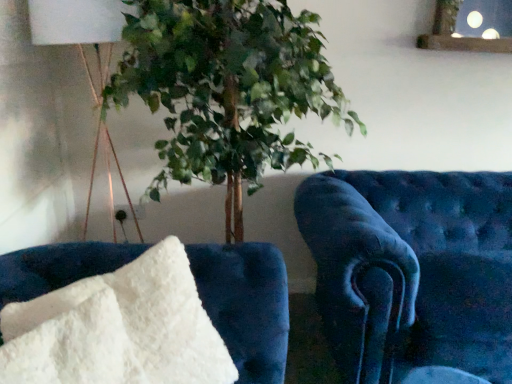
Question: Is white fabric lampshade at upper left to the left of velvet blue armchair at right, positioned as the second furniture in front-to-back order, from the viewer's perspective?

Choices:
 (A) no
 (B) yes

Answer: (B)

Question: From the image's perspective, is white fabric lampshade at upper left on velvet blue armchair at right, the first furniture when ordered from right to left?

Choices:
 (A) yes
 (B) no

Answer: (A)

Question: Could you tell me if white fabric lampshade at upper left is facing velvet blue armchair at right, placed as the 1th furniture when sorted from back to front?

Choices:
 (A) no
 (B) yes

Answer: (A)

Question: From a real-world perspective, is white fabric lampshade at upper left over velvet blue armchair at right, placed as the 1th furniture when sorted from back to front?

Choices:
 (A) yes
 (B) no

Answer: (A)

Question: Would you consider white fabric lampshade at upper left to be distant from velvet blue armchair at right, placed as the 1th furniture when sorted from back to front?

Choices:
 (A) yes
 (B) no

Answer: (A)

Question: Is white fabric lampshade at upper left closer to camera compared to velvet blue armchair at right, placed as the 1th furniture when sorted from back to front?

Choices:
 (A) yes
 (B) no

Answer: (B)

Question: Considering the relative sizes of white fabric lampshade at upper left and white fluffy pillow at lower left, which is the 2th furniture in right-to-left order, in the image provided, is white fabric lampshade at upper left smaller than white fluffy pillow at lower left, which is the 2th furniture in right-to-left order,?

Choices:
 (A) no
 (B) yes

Answer: (A)

Question: Does white fabric lampshade at upper left have a greater height compared to white fluffy pillow at lower left, positioned as the first furniture in front-to-back order?

Choices:
 (A) yes
 (B) no

Answer: (A)

Question: Can you confirm if white fabric lampshade at upper left is shorter than white fluffy pillow at lower left, which is the first furniture from left to right?

Choices:
 (A) yes
 (B) no

Answer: (B)

Question: Is white fabric lampshade at upper left far away from white fluffy pillow at lower left, which is the first furniture from left to right?

Choices:
 (A) no
 (B) yes

Answer: (A)

Question: Is the depth of white fabric lampshade at upper left less than that of white fluffy pillow at lower left, which is the first furniture from left to right?

Choices:
 (A) no
 (B) yes

Answer: (A)

Question: From the image's perspective, is white fabric lampshade at upper left located beneath white fluffy pillow at lower left, which is the first furniture from left to right?

Choices:
 (A) yes
 (B) no

Answer: (B)

Question: Would you say velvet blue armchair at right, the first furniture when ordered from right to left, is a long distance from white fluffy pillow at lower left, the second furniture when ordered from back to front?

Choices:
 (A) yes
 (B) no

Answer: (B)